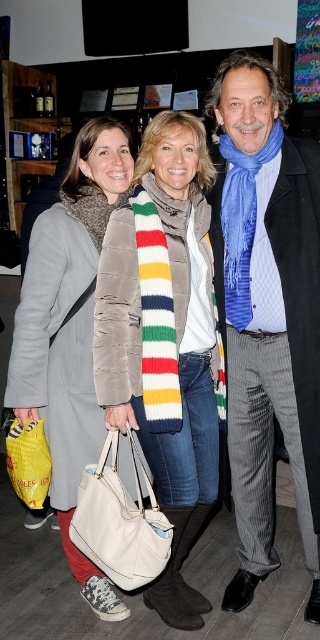
Does white leather handbag at center appear under yellow fabric bag at lower left?

Indeed, white leather handbag at center is positioned under yellow fabric bag at lower left.

Between point (144, 563) and point (47, 467), which one is positioned behind?

The point (47, 467) is behind.

Is point (79, 532) behind point (46, 467)?

No, it is not.

Where is `white leather handbag at center`? white leather handbag at center is located at coordinates (120, 522).

Does matte gray coat at center come behind white leather handbag at center?

Yes, it is.

Consider the image. Does matte gray coat at center have a greater width compared to white leather handbag at center?

Yes.

Which is in front, point (121, 150) or point (128, 577)?

Positioned in front is point (128, 577).

Identify the location of matte gray coat at center. (70, 332).

Does striped wool scarf at center have a larger size compared to matte gray coat at center?

Correct, striped wool scarf at center is larger in size than matte gray coat at center.

Is striped wool scarf at center to the left of matte gray coat at center from the viewer's perspective?

Answer: No, striped wool scarf at center is not to the left of matte gray coat at center.

Between point (206, 428) and point (58, 340), which one is positioned in front?

Point (58, 340)

Where is `striped wool scarf at center`? The height and width of the screenshot is (640, 320). striped wool scarf at center is located at coordinates (165, 340).